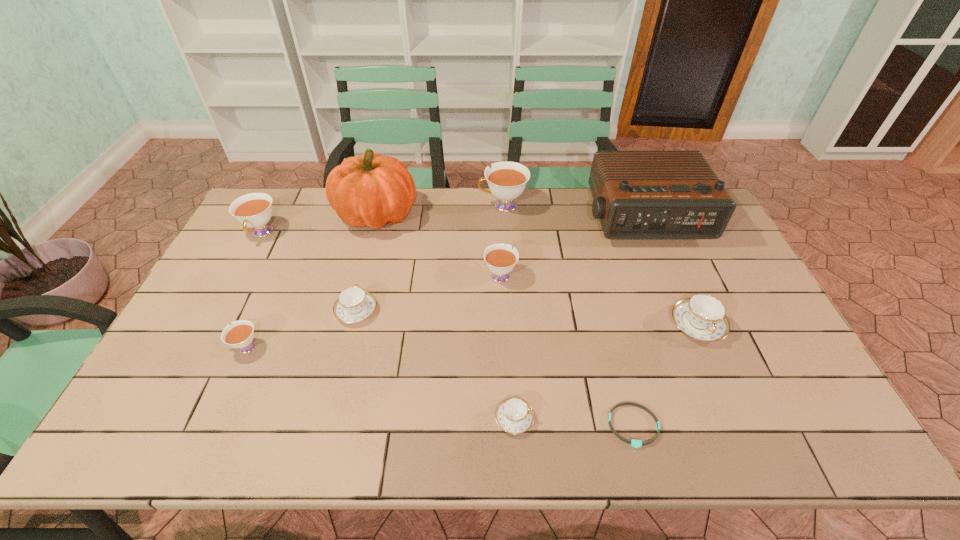
Find the location of `radio receiver that is at the right edge`. radio receiver that is at the right edge is located at coordinates (636, 194).

At what (x,y) coordinates should I click in order to perform the action: click on teacup that is at the right edge. Please return your answer as a coordinate pair (x, y). The width and height of the screenshot is (960, 540). Looking at the image, I should click on (702, 317).

Identify the location of object present at the far left corner. The width and height of the screenshot is (960, 540). (254, 210).

The image size is (960, 540). Find the location of `object located in the far right corner section of the desktop`. object located in the far right corner section of the desktop is located at coordinates (636, 194).

This screenshot has width=960, height=540. I want to click on vacant space at the far edge, so click(483, 197).

The image size is (960, 540). Identify the location of blank area at the near edge. (387, 420).

The width and height of the screenshot is (960, 540). What are the coordinates of `vacant space at the left edge of the desktop` in the screenshot? It's located at (225, 273).

Image resolution: width=960 pixels, height=540 pixels. Identify the location of free spot at the near left corner of the desktop. (149, 445).

The image size is (960, 540). Find the location of `free space between the leftmost object and the rightmost blue teacup`. free space between the leftmost object and the rightmost blue teacup is located at coordinates (479, 279).

Where is `vacant space that is in between the second blue teacup from left to right and the tallest object`? Image resolution: width=960 pixels, height=540 pixels. vacant space that is in between the second blue teacup from left to right and the tallest object is located at coordinates (445, 316).